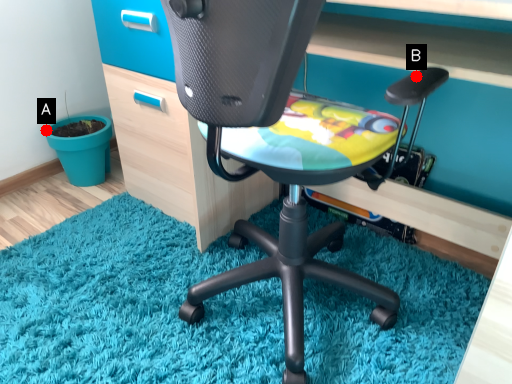
Question: Two points are circled on the image, labeled by A and B beside each circle. Among these points, which one is nearest to the camera?

Choices:
 (A) A is closer
 (B) B is closer

Answer: (B)